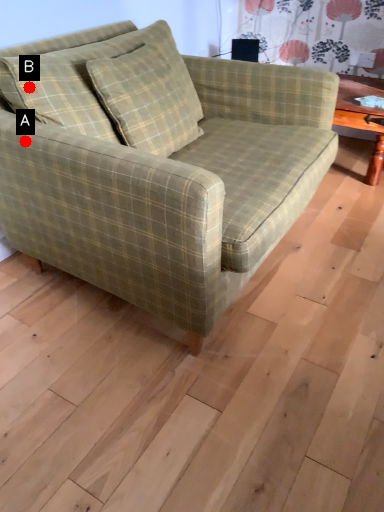
Question: Two points are circled on the image, labeled by A and B beside each circle. Which point is farther to the camera?

Choices:
 (A) A is further
 (B) B is further

Answer: (B)